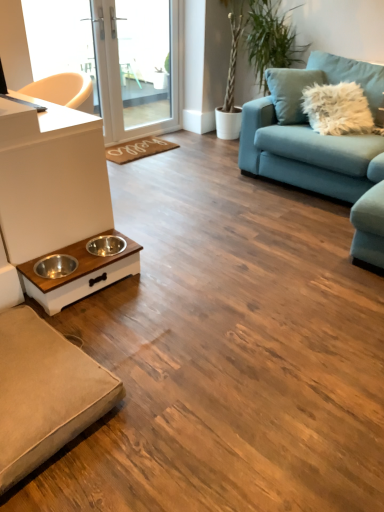
The image size is (384, 512). Find the location of `empty space that is to the right of white wood pet feeder at lower left`. empty space that is to the right of white wood pet feeder at lower left is located at coordinates pyautogui.click(x=168, y=284).